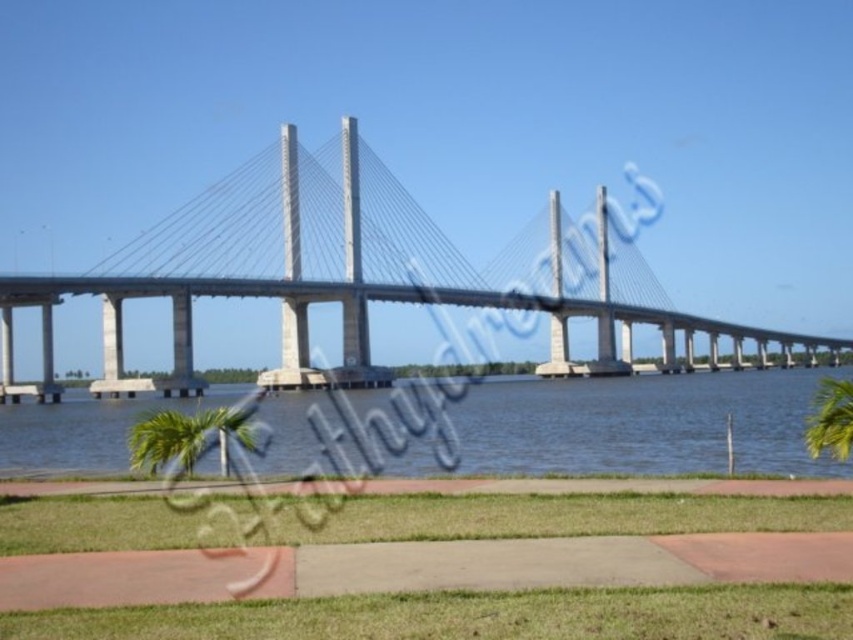
Can you confirm if concrete bridge at center is taller than green leafy palm tree at lower right?

Indeed, concrete bridge at center has a greater height compared to green leafy palm tree at lower right.

Consider the image. Which of these two, concrete bridge at center or green leafy palm tree at lower right, stands taller?

With more height is concrete bridge at center.

Is point (726, 328) closer to camera compared to point (850, 416)?

No, it is behind (850, 416).

At what (x,y) coordinates should I click in order to perform the action: click on concrete bridge at center. Please return your answer as a coordinate pair (x, y). Looking at the image, I should click on pyautogui.click(x=343, y=276).

Is point (173, 444) in front of point (844, 426)?

No, it is behind (844, 426).

Does point (132, 444) lie in front of point (837, 444)?

No.

At what (x,y) coordinates should I click in order to perform the action: click on green leafy palm tree at lower left. Please return your answer as a coordinate pair (x, y). The height and width of the screenshot is (640, 853). Looking at the image, I should click on (187, 436).

Who is lower down, clear water at lower center or green leafy palm tree at lower left?

clear water at lower center

Can you confirm if clear water at lower center is positioned below green leafy palm tree at lower left?

Correct, clear water at lower center is located below green leafy palm tree at lower left.

Between point (413, 444) and point (136, 458), which one is positioned in front?

Point (136, 458) is in front.

The width and height of the screenshot is (853, 640). Find the location of `clear water at lower center`. clear water at lower center is located at coordinates (642, 422).